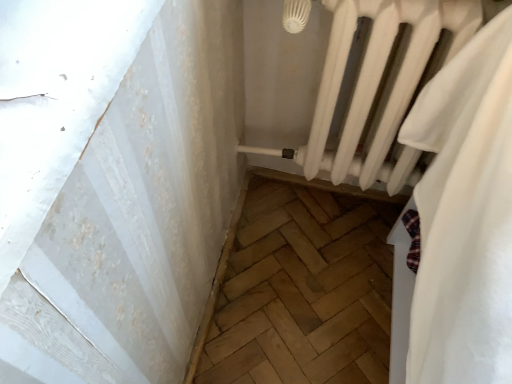
Measure the distance between white matte radiator at upper right and camera.

white matte radiator at upper right and camera are 79.05 centimeters apart.

The width and height of the screenshot is (512, 384). What do you see at coordinates (379, 83) in the screenshot?
I see `white matte radiator at upper right` at bounding box center [379, 83].

Where is `white matte radiator at upper right`? white matte radiator at upper right is located at coordinates (379, 83).

The width and height of the screenshot is (512, 384). I want to click on white matte radiator at upper right, so click(x=379, y=83).